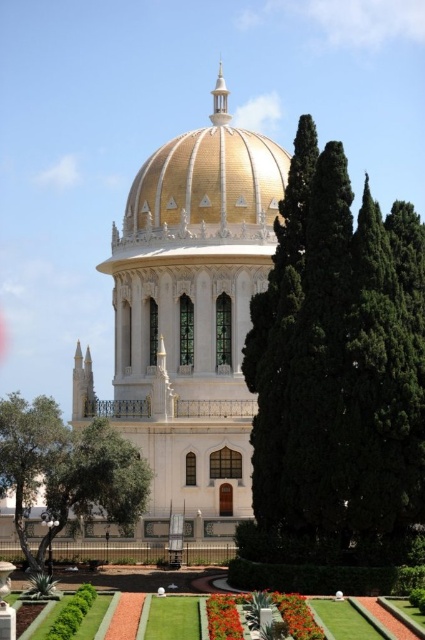
You are standing in the garden and want to take a photo of both the white marble palace at center and the smooth red flower at center. Which object should you focus on first to ensure both are in the frame?

You should focus on the white marble palace at center first because it is closer to you than the smooth red flower at center, ensuring both are in the frame.

You are standing in the garden in front of the grand building with the golden dome. You see two points marked in the image. The first point is at coordinates point [204,282] and the second point is at point [246,161]. Which of these two points is closer to you as you face the building?

Point [204,282] is in front of point [246,161], so it is closer to you as you face the building.